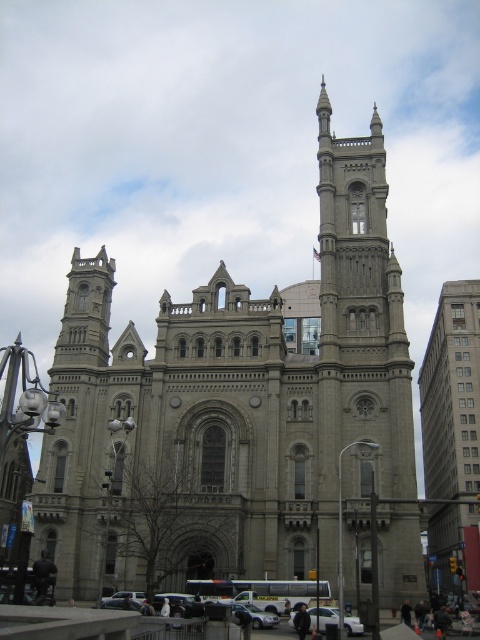
Question: Among these points, which one is farthest from the camera?

Choices:
 (A) (322, 609)
 (B) (379, 132)

Answer: (B)

Question: Does gray stone church at center appear on the right side of white matte car at lower center?

Choices:
 (A) yes
 (B) no

Answer: (B)

Question: Observing the image, what is the correct spatial positioning of gray stone building at right in reference to gray stone tower at upper center?

Choices:
 (A) left
 (B) right

Answer: (B)

Question: Is gray stone building at right smaller than white matte car at lower center?

Choices:
 (A) yes
 (B) no

Answer: (B)

Question: Which object appears farthest from the camera in this image?

Choices:
 (A) white matte car at lower center
 (B) gray stone building at right
 (C) gray stone tower at upper center

Answer: (B)

Question: Which of the following is the closest to the observer?

Choices:
 (A) gray stone church at center
 (B) gray stone tower at upper center
 (C) white matte car at lower center
 (D) gray stone building at right

Answer: (C)